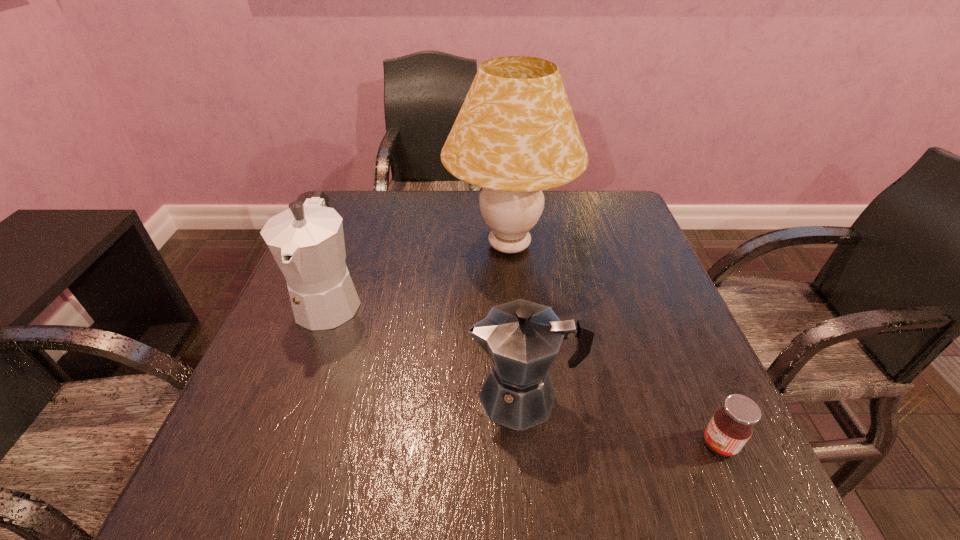
Where is `free region located at the spout of the third tallest object`? This screenshot has width=960, height=540. free region located at the spout of the third tallest object is located at coordinates (413, 396).

Locate an element on the screen. The width and height of the screenshot is (960, 540). free space located 0.310m at the spout of the third tallest object is located at coordinates (297, 396).

Identify the location of free space located 0.220m on the label side of the jam. (567, 444).

Locate an element on the screen. This screenshot has width=960, height=540. vacant space located 0.380m on the label side of the jam is located at coordinates (470, 444).

Locate an element on the screen. vacant space located on the label side of the jam is located at coordinates (647, 444).

The width and height of the screenshot is (960, 540). Find the location of `object at the far edge`. object at the far edge is located at coordinates (515, 135).

Image resolution: width=960 pixels, height=540 pixels. I want to click on object that is positioned at the near edge, so click(731, 426).

Where is `object situated at the left edge`? object situated at the left edge is located at coordinates (307, 241).

In order to click on object that is at the right edge in this screenshot , I will do `click(731, 426)`.

Where is `object that is at the near right corner`? This screenshot has height=540, width=960. object that is at the near right corner is located at coordinates (731, 426).